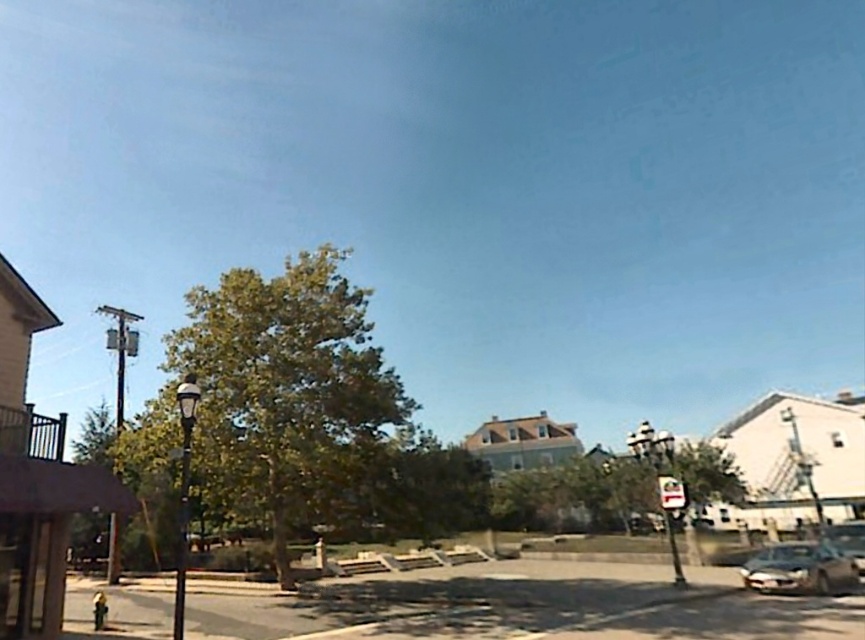
Can you confirm if shiny silver car at lower right is positioned below white plastic street sign at center?

Indeed, shiny silver car at lower right is positioned under white plastic street sign at center.

Who is shorter, shiny silver car at lower right or white plastic street sign at center?

With less height is white plastic street sign at center.

The height and width of the screenshot is (640, 865). What do you see at coordinates (798, 568) in the screenshot?
I see `shiny silver car at lower right` at bounding box center [798, 568].

Find the location of a particular element. This screenshot has height=640, width=865. shiny silver car at lower right is located at coordinates (798, 568).